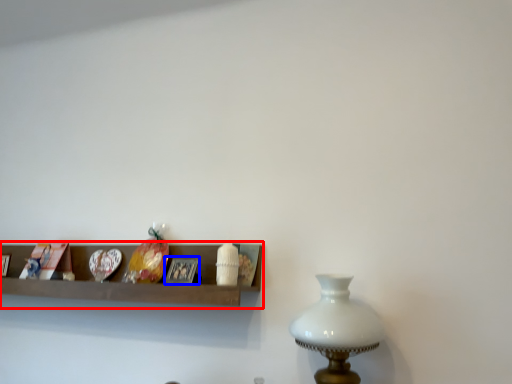
Question: Which of the following is the closest to the observer, shelf (highlighted by a red box) or picture frame (highlighted by a blue box)?

Choices:
 (A) shelf
 (B) picture frame

Answer: (A)